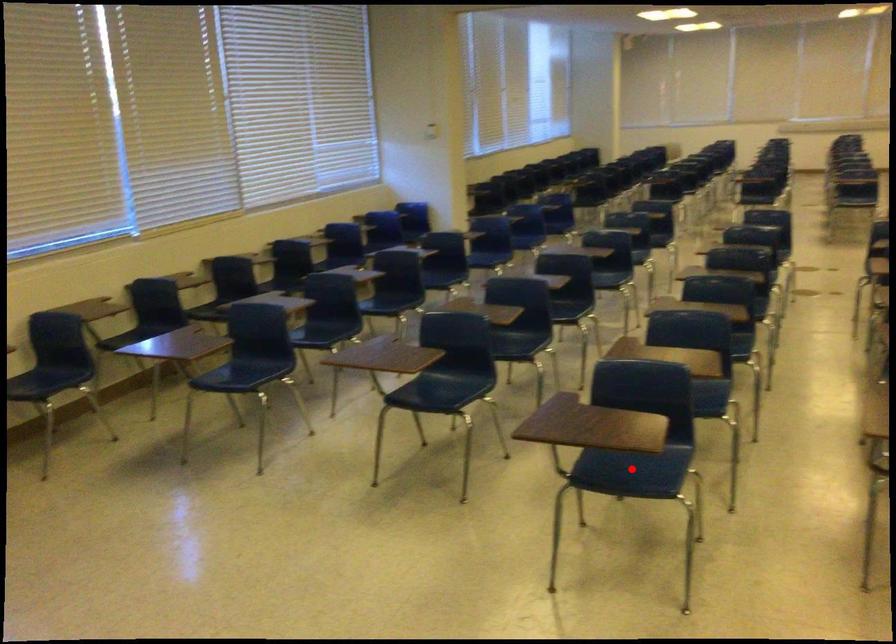
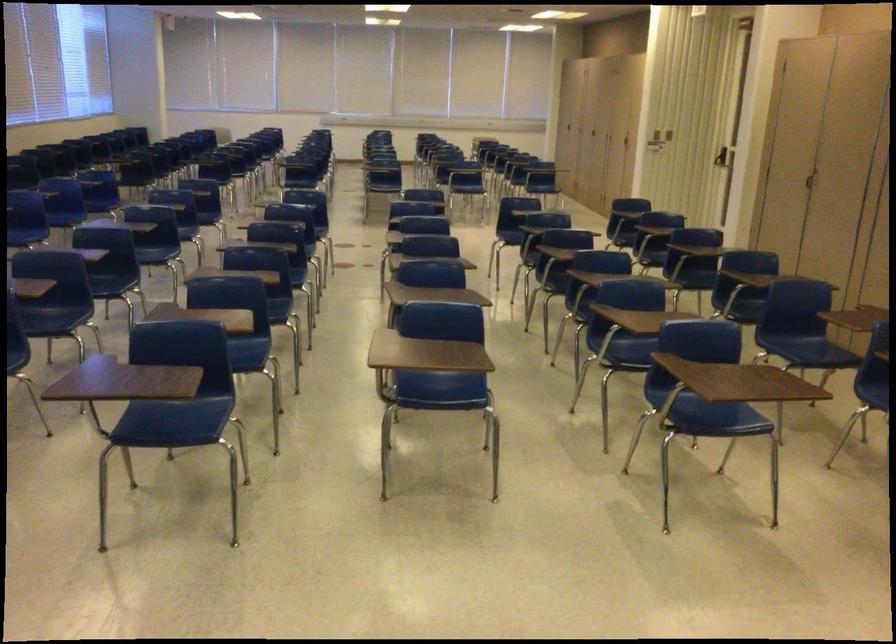
Find the pixel in the second image that matches the highlighted location in the first image.

(173, 422)